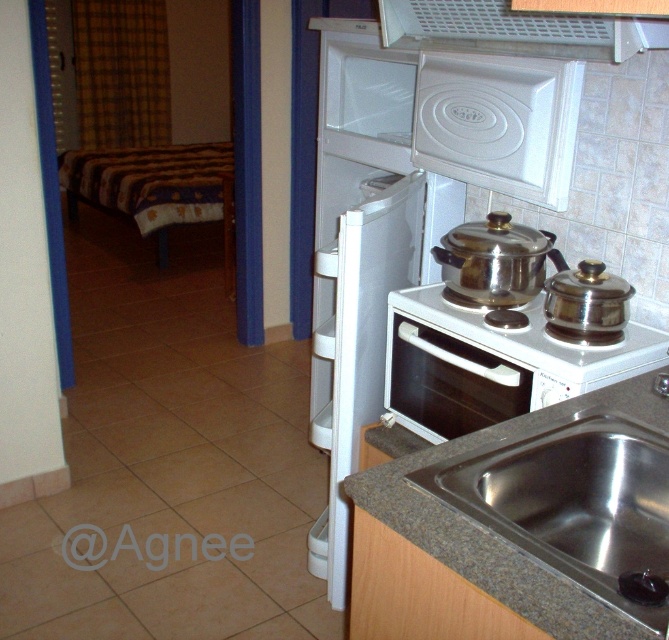
Question: Which object is the closest to the white glossy oven at center?

Choices:
 (A) stainless steel stove at center
 (B) stainless steel sink at lower right

Answer: (B)

Question: Is stainless steel stove at center positioned behind stainless steel sink at lower right?

Choices:
 (A) yes
 (B) no

Answer: (A)

Question: Which of these objects is positioned closest to the stainless steel stove at center?

Choices:
 (A) white glossy oven at center
 (B) white glossy gas stove at center
 (C) stainless steel sink at lower right

Answer: (A)

Question: Estimate the real-world distances between objects in this image. Which object is farther from the white textured exhaust hood at upper center?

Choices:
 (A) white glossy oven at center
 (B) stainless steel stove at center

Answer: (A)

Question: Is stainless steel stove at center to the right of white glossy oven at center from the viewer's perspective?

Choices:
 (A) yes
 (B) no

Answer: (B)

Question: Does stainless steel stove at center lie behind white glossy oven at center?

Choices:
 (A) no
 (B) yes

Answer: (B)